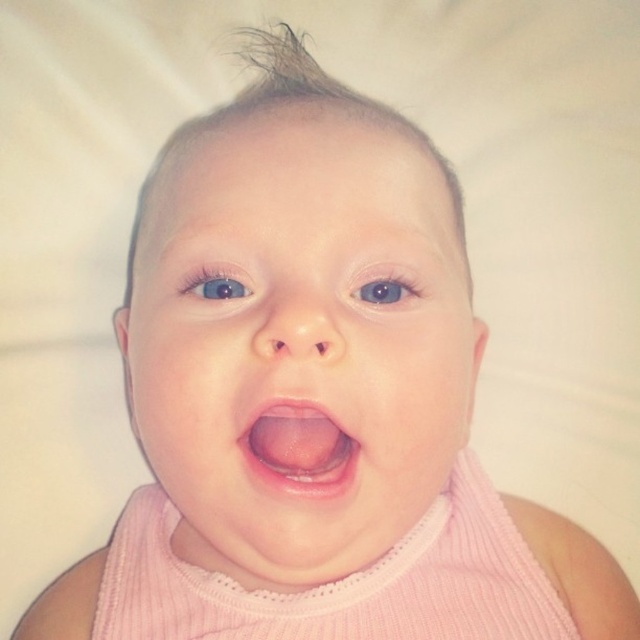
Does smooth pink baby at center appear under pink glossy tongue at center?

No, smooth pink baby at center is not below pink glossy tongue at center.

Does smooth pink baby at center have a greater height compared to pink glossy tongue at center?

Indeed, smooth pink baby at center has a greater height compared to pink glossy tongue at center.

This screenshot has width=640, height=640. What are the coordinates of `smooth pink baby at center` in the screenshot? It's located at (298, 340).

Where is `smooth pink baby at center`? The width and height of the screenshot is (640, 640). smooth pink baby at center is located at coordinates (298, 340).